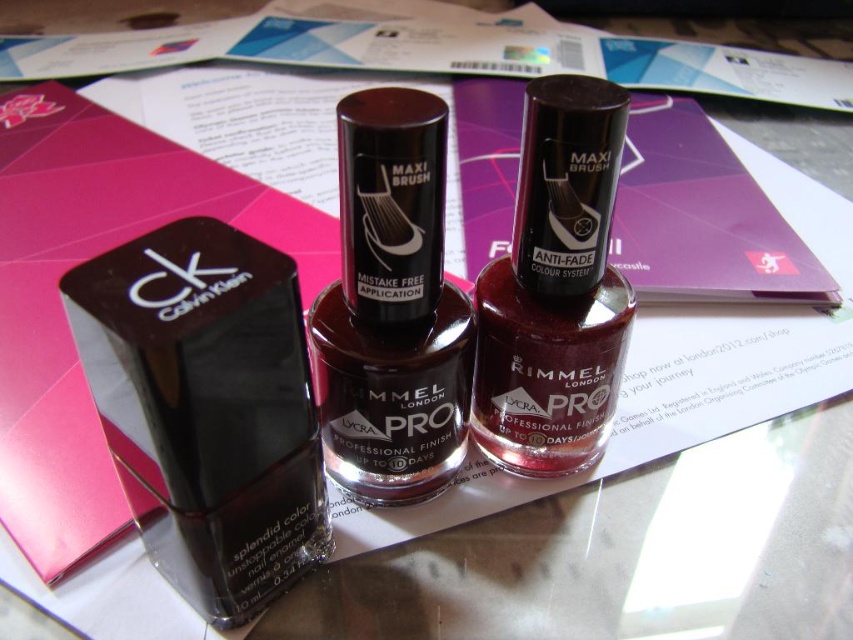
You are organizing a beauty counter and need to arrange the matte black nail polish at left and the satin burgundy nail polish at center based on their heights. Which bottle should you place on the lower shelf to ensure proper display?

The matte black nail polish at left is shorter in height than the satin burgundy nail polish at center, so it should be placed on the lower shelf to ensure proper display.

You are a customer standing 60 centimeters away from the satin burgundy nail polish at center. Can you comfortably reach it without moving your position?

The satin burgundy nail polish at center is 62.11 centimeters away from the viewer. Since you are standing 60 centimeters away, you are still 2.11 centimeters short to comfortably reach it without moving closer.

You are organizing a beauty counter and need to place the matte black nail polish at left and the shiny burgundy nail polish at center. If you want to arrange them so that the closer bottle is on the left side of the display, does their current arrangement already meet this requirement?

Yes, the current arrangement meets the requirement because the matte black nail polish at left is closer to the viewer than the shiny burgundy nail polish at center, so placing it on the left side of the display maintains its proximity.